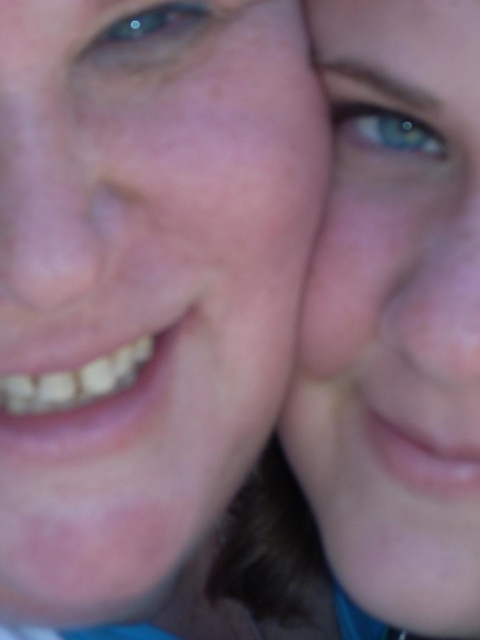
Which is more to the left, smooth skin at center or blue matte skin at upper right?

From the viewer's perspective, smooth skin at center appears more on the left side.

Is point (171, 97) positioned before point (343, 371)?

Yes, it is.

Which is in front, point (31, 35) or point (418, 129)?

Point (31, 35) is more forward.

Identify the location of smooth skin at center. The image size is (480, 640). (143, 282).